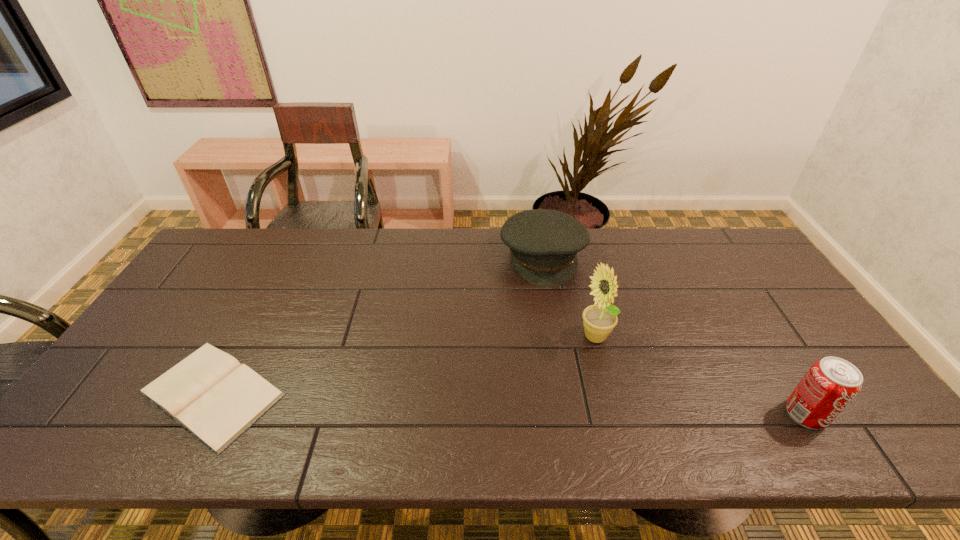
The image size is (960, 540). Find the location of `free space between the third shortest object and the beret`. free space between the third shortest object and the beret is located at coordinates (674, 335).

The image size is (960, 540). I want to click on empty location between the sunflower and the third shortest object, so 701,376.

The height and width of the screenshot is (540, 960). Find the location of `free spot between the beret and the shortest object`. free spot between the beret and the shortest object is located at coordinates (377, 325).

Find the location of a particular element. The image size is (960, 540). free space between the second tallest object and the tallest object is located at coordinates (701, 376).

Where is `vacant space in between the rightmost object and the farthest object`? This screenshot has height=540, width=960. vacant space in between the rightmost object and the farthest object is located at coordinates (674, 335).

The width and height of the screenshot is (960, 540). I want to click on free space between the sunflower and the shortest object, so click(x=404, y=366).

Select which object appears as the second closest to the shortest object. Please provide its 2D coordinates. Your answer should be formatted as a tuple, i.e. [(x, y)], where the tuple contains the x and y coordinates of a point satisfying the conditions above.

[(599, 320)]

Find the location of a particular element. The image size is (960, 540). object that ranks as the second closest to the shortest object is located at coordinates (599, 320).

What are the coordinates of `free space that satisfies the following two spatial constraints: 1. on the front side of the soda can; 2. on the right side of the Bible` in the screenshot? It's located at (202, 414).

Where is `free space that satisfies the following two spatial constraints: 1. on the front side of the sunflower; 2. on the right side of the second shortest object`? Image resolution: width=960 pixels, height=540 pixels. free space that satisfies the following two spatial constraints: 1. on the front side of the sunflower; 2. on the right side of the second shortest object is located at coordinates (557, 339).